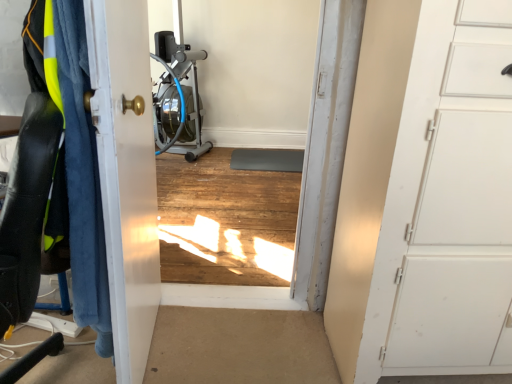
Describe the element at coordinates (178, 97) in the screenshot. I see `metallic silver rowing machine at center` at that location.

The height and width of the screenshot is (384, 512). Find the location of `matte black swivel chair at left`. matte black swivel chair at left is located at coordinates (27, 209).

Describe the element at coordinates (447, 205) in the screenshot. I see `white matte door at right, which is counted as the second door, starting from the left` at that location.

The image size is (512, 384). Find the location of `white matte door at right, which is counted as the second door, starting from the left`. white matte door at right, which is counted as the second door, starting from the left is located at coordinates (447, 205).

I want to click on white glossy door at left, arranged as the second door when viewed from the right, so click(x=126, y=175).

Is point (489, 205) closer to camera compared to point (84, 266)?

That is False.

Do you think white matte door at right, the 1th door from the right, is within blue fuzzy blanket at left, or outside of it?

white matte door at right, the 1th door from the right, is not enclosed by blue fuzzy blanket at left.

Can you confirm if white matte door at right, the 1th door from the right, is positioned to the left of blue fuzzy blanket at left?

In fact, white matte door at right, the 1th door from the right, is to the right of blue fuzzy blanket at left.

From a real-world perspective, is white matte door at right, which is counted as the second door, starting from the left, under blue fuzzy blanket at left?

Yes, from a real-world perspective, white matte door at right, which is counted as the second door, starting from the left, is below blue fuzzy blanket at left.

Which object is thinner, matte black swivel chair at left or metallic silver rowing machine at center?

matte black swivel chair at left.

Considering the relative positions of matte black swivel chair at left and metallic silver rowing machine at center in the image provided, is matte black swivel chair at left to the left or to the right of metallic silver rowing machine at center?

Clearly, matte black swivel chair at left is on the right of metallic silver rowing machine at center in the image.

In the scene shown: Is matte black swivel chair at left not near metallic silver rowing machine at center?

Yes.

Does matte black swivel chair at left turn towards metallic silver rowing machine at center?

No.

Is white matte door at right, which is counted as the second door, starting from the left, to the left or to the right of metallic silver rowing machine at center in the image?

Based on their positions, white matte door at right, which is counted as the second door, starting from the left, is located to the right of metallic silver rowing machine at center.

Is white matte door at right, the 1th door from the right, bigger or smaller than metallic silver rowing machine at center?

Clearly, white matte door at right, the 1th door from the right, is larger in size than metallic silver rowing machine at center.

Considering the sizes of objects white matte door at right, which is counted as the second door, starting from the left, and metallic silver rowing machine at center in the image provided, who is wider, white matte door at right, which is counted as the second door, starting from the left, or metallic silver rowing machine at center?

metallic silver rowing machine at center.

What's the angular difference between white matte door at right, the 1th door from the right, and metallic silver rowing machine at center's facing directions?

The angular difference between white matte door at right, the 1th door from the right, and metallic silver rowing machine at center is 2.59 degrees.

From the image's perspective, is white glossy door at left, arranged as the second door when viewed from the right, located above or below blue fuzzy blanket at left?

Based on their image positions, white glossy door at left, arranged as the second door when viewed from the right, is located beneath blue fuzzy blanket at left.

From a real-world perspective, is white glossy door at left, which appears as the 1th door when viewed from the left, on top of blue fuzzy blanket at left?

Actually, white glossy door at left, which appears as the 1th door when viewed from the left, is physically below blue fuzzy blanket at left in the real world.

Which object is positioned more to the left, white glossy door at left, arranged as the second door when viewed from the right, or blue fuzzy blanket at left?

blue fuzzy blanket at left.

Considering the sizes of objects white glossy door at left, which appears as the 1th door when viewed from the left, and blue fuzzy blanket at left in the image provided, who is bigger, white glossy door at left, which appears as the 1th door when viewed from the left, or blue fuzzy blanket at left?

white glossy door at left, which appears as the 1th door when viewed from the left, is bigger.

From the image's perspective, is blue fuzzy blanket at left located above or below metallic silver rowing machine at center?

Clearly, from the image's perspective, blue fuzzy blanket at left is below metallic silver rowing machine at center.

Can we say blue fuzzy blanket at left lies outside metallic silver rowing machine at center?

Indeed, blue fuzzy blanket at left is completely outside metallic silver rowing machine at center.

Is the depth of blue fuzzy blanket at left greater than that of metallic silver rowing machine at center?

No, it is not.

Is there a large distance between metallic silver rowing machine at center and blue fuzzy blanket at left?

Yes, metallic silver rowing machine at center and blue fuzzy blanket at left are located far from each other.

How many degrees apart are the facing directions of metallic silver rowing machine at center and blue fuzzy blanket at left?

The facing directions of metallic silver rowing machine at center and blue fuzzy blanket at left are 70.3 degrees apart.

What are the coordinates of `sport equipment behind the blue fuzzy blanket at left` in the screenshot? It's located at (178, 97).

Between white glossy door at left, which appears as the 1th door when viewed from the left, and white matte door at right, which is counted as the second door, starting from the left, which one appears on the right side from the viewer's perspective?

Positioned to the right is white matte door at right, which is counted as the second door, starting from the left.

Between white glossy door at left, which appears as the 1th door when viewed from the left, and white matte door at right, which is counted as the second door, starting from the left, which one has smaller size?

white glossy door at left, which appears as the 1th door when viewed from the left.

Locate an element on the screen. The height and width of the screenshot is (384, 512). door that appears below the white glossy door at left, which appears as the 1th door when viewed from the left (from the image's perspective) is located at coordinates (447, 205).

Image resolution: width=512 pixels, height=384 pixels. I want to click on the 2nd door below the blue fuzzy blanket at left (from the image's perspective), so click(x=447, y=205).

At what (x,y) coordinates should I click in order to perform the action: click on swivel chair located on the right of metallic silver rowing machine at center. Please return your answer as a coordinate pair (x, y). The width and height of the screenshot is (512, 384). Looking at the image, I should click on (27, 209).

Which object lies further to the anchor point white matte door at right, which is counted as the second door, starting from the left, metallic silver rowing machine at center or blue fuzzy blanket at left?

metallic silver rowing machine at center is further to white matte door at right, which is counted as the second door, starting from the left.

Which object lies further to the anchor point matte black swivel chair at left, blue fuzzy blanket at left or white glossy door at left, arranged as the second door when viewed from the right?

white glossy door at left, arranged as the second door when viewed from the right, lies further to matte black swivel chair at left than the other object.

Looking at the image, which one is located closer to white matte door at right, the 1th door from the right, matte black swivel chair at left or metallic silver rowing machine at center?

matte black swivel chair at left is closer to white matte door at right, the 1th door from the right.

Looking at the image, which one is located further to white matte door at right, the 1th door from the right, metallic silver rowing machine at center or matte black swivel chair at left?

The object further to white matte door at right, the 1th door from the right, is metallic silver rowing machine at center.

When comparing their distances from white glossy door at left, arranged as the second door when viewed from the right, does metallic silver rowing machine at center or blue fuzzy blanket at left seem closer?

Among the two, blue fuzzy blanket at left is located nearer to white glossy door at left, arranged as the second door when viewed from the right.

In the scene shown: Which object lies further to the anchor point white glossy door at left, which appears as the 1th door when viewed from the left, matte black swivel chair at left or white matte door at right, the 1th door from the right?

Based on the image, white matte door at right, the 1th door from the right, appears to be further to white glossy door at left, which appears as the 1th door when viewed from the left.

Which object lies nearer to the anchor point blue fuzzy blanket at left, metallic silver rowing machine at center or white matte door at right, the 1th door from the right?

white matte door at right, the 1th door from the right, lies closer to blue fuzzy blanket at left than the other object.

When comparing their distances from blue fuzzy blanket at left, does matte black swivel chair at left or white matte door at right, which is counted as the second door, starting from the left, seem closer?

matte black swivel chair at left lies closer to blue fuzzy blanket at left than the other object.

Find the location of a particular element. The image size is (512, 384). clothing between matte black swivel chair at left and metallic silver rowing machine at center along the z-axis is located at coordinates (82, 178).

Image resolution: width=512 pixels, height=384 pixels. I want to click on door between blue fuzzy blanket at left and metallic silver rowing machine at center from front to back, so click(447, 205).

I want to click on clothing situated between matte black swivel chair at left and white glossy door at left, arranged as the second door when viewed from the right, from left to right, so click(x=82, y=178).

This screenshot has width=512, height=384. What are the coordinates of `clothing between matte black swivel chair at left and white matte door at right, which is counted as the second door, starting from the left, in the horizontal direction` in the screenshot? It's located at (82, 178).